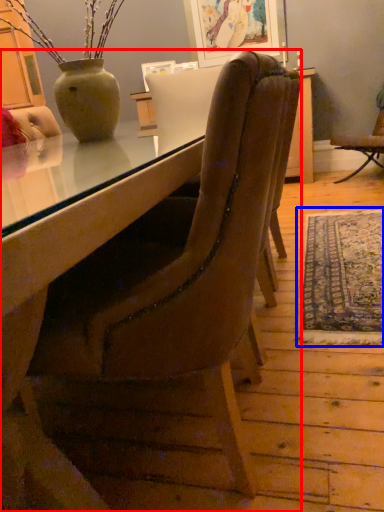
Question: Which of the following is the closest to the observer, chair (highlighted by a red box) or mat (highlighted by a blue box)?

Choices:
 (A) chair
 (B) mat

Answer: (A)